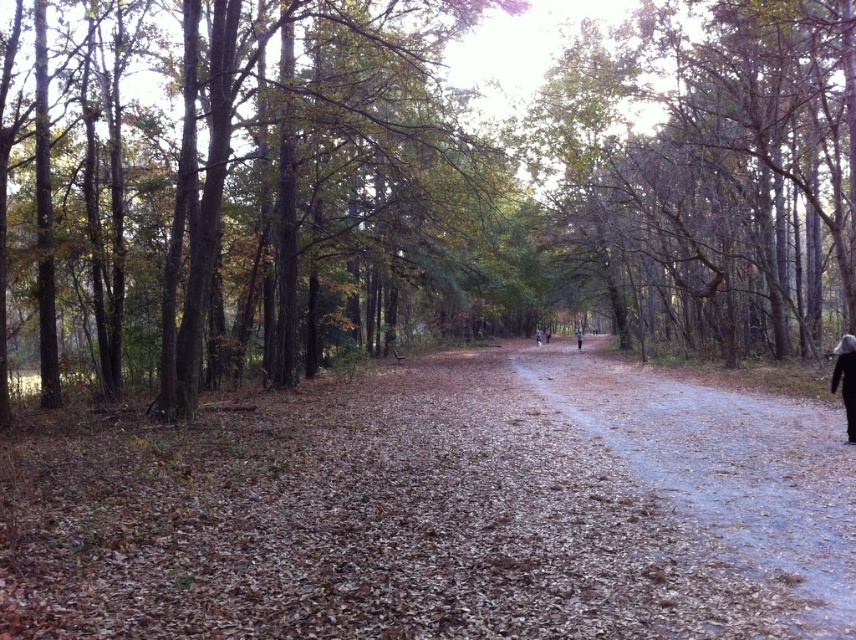
Question: Which point is closer to the camera taking this photo?

Choices:
 (A) (645, 291)
 (B) (654, 387)
 (C) (502, 513)
 (D) (849, 413)

Answer: (C)

Question: Does green leafy tree at center have a smaller size compared to dark gray woolen coat at right?

Choices:
 (A) yes
 (B) no

Answer: (B)

Question: Is brown wood tree at left thinner than brown dirt path at center?

Choices:
 (A) yes
 (B) no

Answer: (B)

Question: Which object is closer to the camera taking this photo?

Choices:
 (A) dark gray woolen coat at right
 (B) brown wood tree at left

Answer: (A)

Question: Can you confirm if brown dirt path at center is bigger than dark gray woolen coat at right?

Choices:
 (A) yes
 (B) no

Answer: (A)

Question: Based on their relative distances, which object is nearer to the brown dirt path at center?

Choices:
 (A) green leafy tree at center
 (B) dark gray woolen coat at right
 (C) brown wood tree at left
 (D) brown leafy forest path at center

Answer: (D)